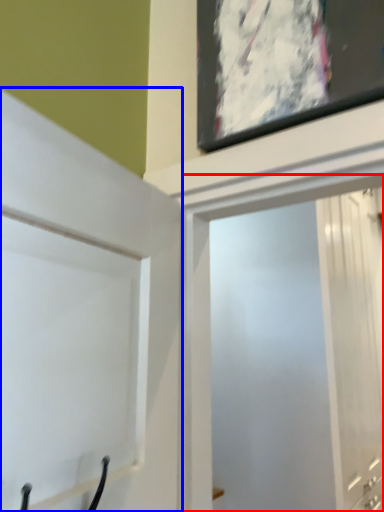
Question: Which point is further to the camera, screen door (highlighted by a red box) or door (highlighted by a blue box)?

Choices:
 (A) screen door
 (B) door

Answer: (A)